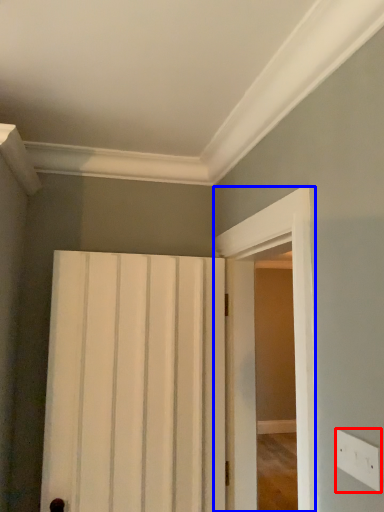
Question: Among these objects, which one is farthest to the camera, electric outlet (highlighted by a red box) or screen door (highlighted by a blue box)?

Choices:
 (A) electric outlet
 (B) screen door

Answer: (B)